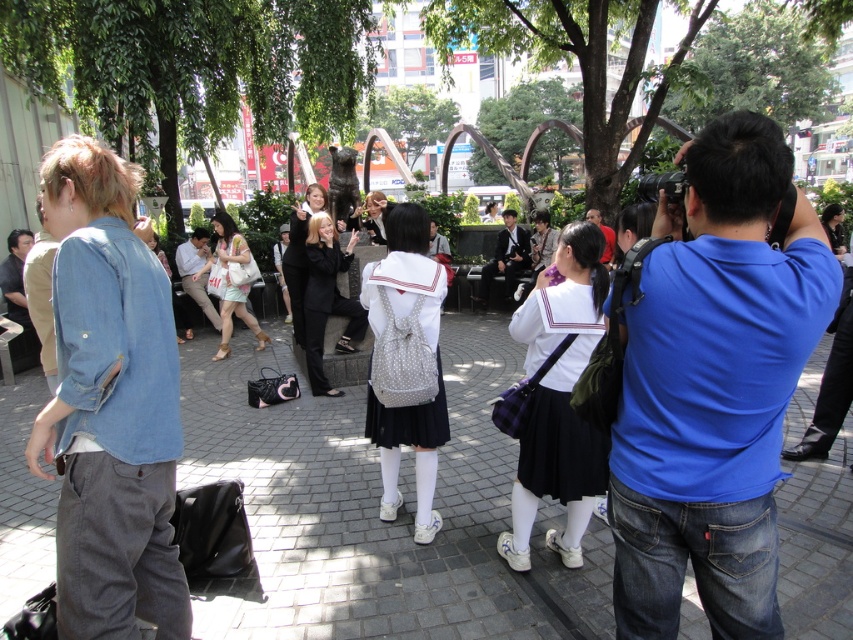
Which is above, white fabric backpack at center or light brown leather shoes at center?

light brown leather shoes at center is above.

Does point (407, 256) lie behind point (201, 275)?

No, (407, 256) is in front of (201, 275).

Identify the location of white fabric backpack at center. The image size is (853, 640). (408, 444).

Consider the image. Is the position of blue denim shirt at right less distant than that of white fabric skirt at center?

Yes, blue denim shirt at right is in front of white fabric skirt at center.

Who is more forward, (689, 252) or (579, 288)?

Point (689, 252) is more forward.

Image resolution: width=853 pixels, height=640 pixels. Identify the location of blue denim shirt at right. (712, 387).

Who is lower down, white fabric skirt at center or light pink fabric purse at center?

white fabric skirt at center

Which is above, white fabric skirt at center or light pink fabric purse at center?

light pink fabric purse at center

Identify the location of white fabric skirt at center. (560, 400).